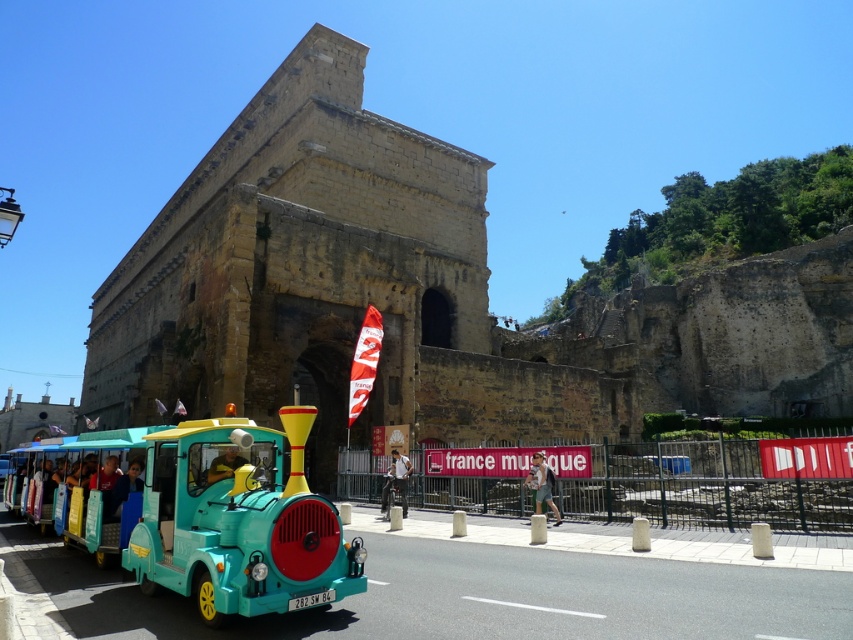
Question: Based on their relative distances, which object is nearer to the green fabric shirt at center?

Choices:
 (A) light blue fabric bicycle at center
 (B) yellow fabric person at center

Answer: (A)

Question: Is light blue fabric bicycle at center closer to camera compared to green fabric shirt at center?

Choices:
 (A) no
 (B) yes

Answer: (A)

Question: Is light blue fabric bicycle at center to the right of yellow fabric person at center from the viewer's perspective?

Choices:
 (A) yes
 (B) no

Answer: (A)

Question: Does light blue fabric bicycle at center lie in front of green fabric shirt at center?

Choices:
 (A) no
 (B) yes

Answer: (A)

Question: Which object is the farthest from the light blue fabric bicycle at center?

Choices:
 (A) yellow fabric person at center
 (B) green fabric shirt at center

Answer: (A)

Question: Which point is closer to the camera?

Choices:
 (A) light blue fabric bicycle at center
 (B) green fabric shirt at center
 (C) yellow fabric person at center

Answer: (C)